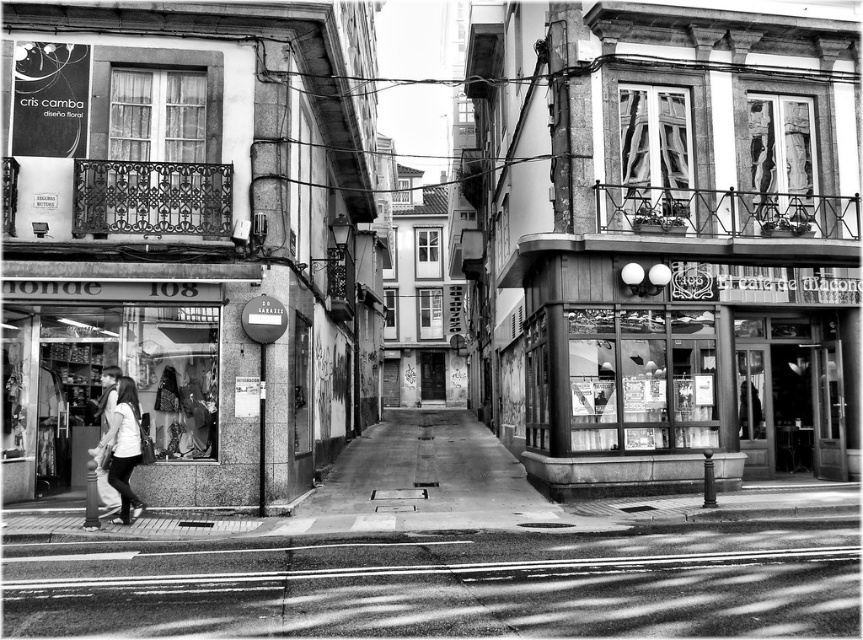
Question: Which of the following is the closest to the observer?

Choices:
 (A) smooth concrete pavement at center
 (B) smooth concrete pavement at lower center

Answer: (B)

Question: Which object appears closest to the camera in this image?

Choices:
 (A) light gray fabric jacket at lower left
 (B) smooth concrete pavement at lower center
 (C) smooth white shirt at lower left

Answer: (B)

Question: Can you confirm if smooth concrete pavement at lower center is positioned below light gray fabric jacket at lower left?

Choices:
 (A) yes
 (B) no

Answer: (A)

Question: Where is glass storefront at center located in relation to smooth white shirt at lower left in the image?

Choices:
 (A) below
 (B) above

Answer: (B)

Question: Can you confirm if smooth concrete pavement at lower center is wider than smooth concrete pavement at center?

Choices:
 (A) no
 (B) yes

Answer: (A)

Question: Which point is closer to the camera?

Choices:
 (A) (121, 388)
 (B) (616, 396)

Answer: (A)